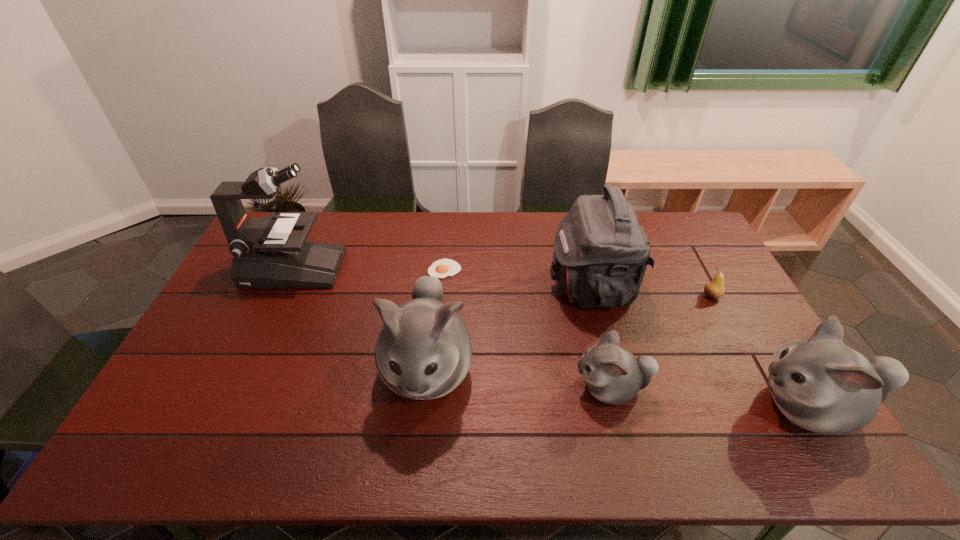
Where is `free space at the right edge of the desktop`? This screenshot has height=540, width=960. free space at the right edge of the desktop is located at coordinates (701, 295).

Identify the location of free point at the near left corner. (162, 401).

Where is `free space at the far right corner of the desktop`? This screenshot has height=540, width=960. free space at the far right corner of the desktop is located at coordinates (689, 214).

This screenshot has height=540, width=960. Identify the location of free spot between the shoulder bag and the leftmost hamster. (509, 328).

You are a GUI agent. You are given a task and a screenshot of the screen. Output one action in this format:
    pyautogui.click(x=<x>, y=<y>)
    Task: Click on the vacant space in between the shoulder bag and the leftmost hamster
    This screenshot has width=960, height=540.
    Given the screenshot: What is the action you would take?
    pyautogui.click(x=509, y=328)

This screenshot has width=960, height=540. What are the coordinates of `empty space between the shortest object and the shoulder bag` in the screenshot? It's located at (517, 278).

At what (x,y) coordinates should I click in order to perform the action: click on empty location between the leftmost hamster and the shoulder bag. Please return your answer as a coordinate pair (x, y). This screenshot has width=960, height=540. Looking at the image, I should click on (509, 328).

Find the location of a particular element. Image resolution: width=960 pixels, height=540 pixels. the fifth closest object relative to the microscope is located at coordinates (714, 289).

Identify which object is located as the second nearest to the leftmost object. Please provide its 2D coordinates. Your answer should be formatted as a tuple, i.e. [(x, y)], where the tuple contains the x and y coordinates of a point satisfying the conditions above.

[(442, 268)]

Point out which hamster is positioned as the nearest to the shortest hamster. Please provide its 2D coordinates. Your answer should be formatted as a tuple, i.e. [(x, y)], where the tuple contains the x and y coordinates of a point satisfying the conditions above.

[(822, 385)]